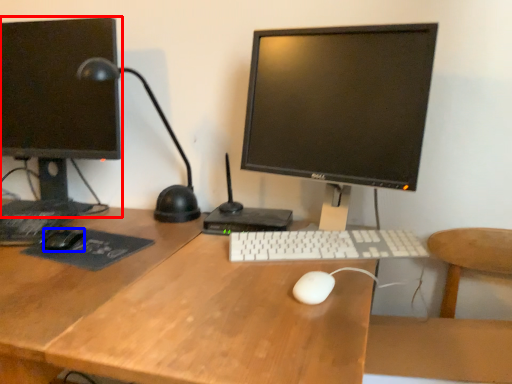
Question: Which object appears farthest to the camera in this image, computer monitor (highlighted by a red box) or mouse (highlighted by a blue box)?

Choices:
 (A) computer monitor
 (B) mouse

Answer: (A)